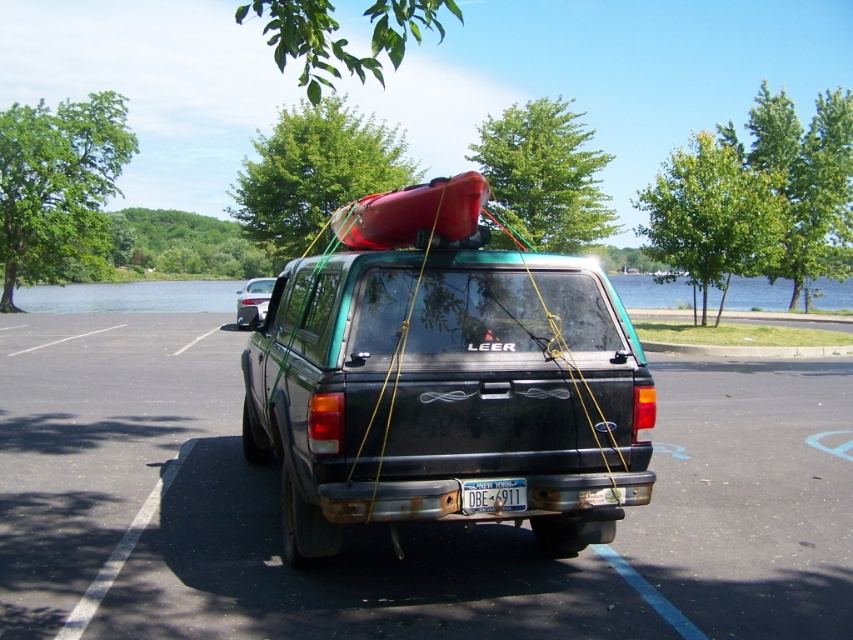
Question: Which object is positioned farthest from the matte black truck at center?

Choices:
 (A) white plastic license plate at center
 (B) black matte truck at center
 (C) satin silver sedan at rear

Answer: (C)

Question: Can you confirm if matte black truck at center is positioned to the right of satin silver sedan at rear?

Choices:
 (A) yes
 (B) no

Answer: (A)

Question: Which object appears farthest from the camera in this image?

Choices:
 (A) white plastic license plate at center
 (B) satin silver sedan at rear
 (C) matte black truck at center
 (D) black matte truck at center

Answer: (B)

Question: Does matte black truck at center appear over white plastic license plate at center?

Choices:
 (A) no
 (B) yes

Answer: (B)

Question: Which is nearer to the matte black truck at center?

Choices:
 (A) black matte truck at center
 (B) white plastic license plate at center
 (C) satin silver sedan at rear

Answer: (B)

Question: Can you confirm if black matte truck at center is wider than satin silver sedan at rear?

Choices:
 (A) yes
 (B) no

Answer: (A)